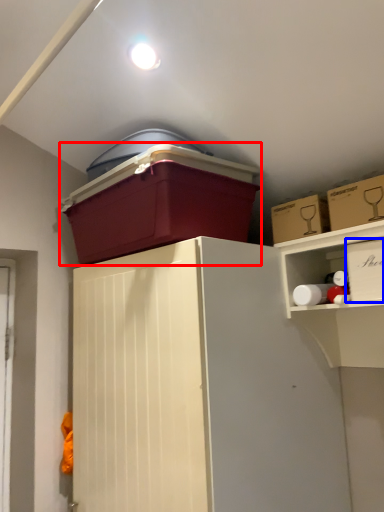
Question: Which point is further to the camera, storage box (highlighted by a red box) or storage box (highlighted by a blue box)?

Choices:
 (A) storage box
 (B) storage box

Answer: (A)